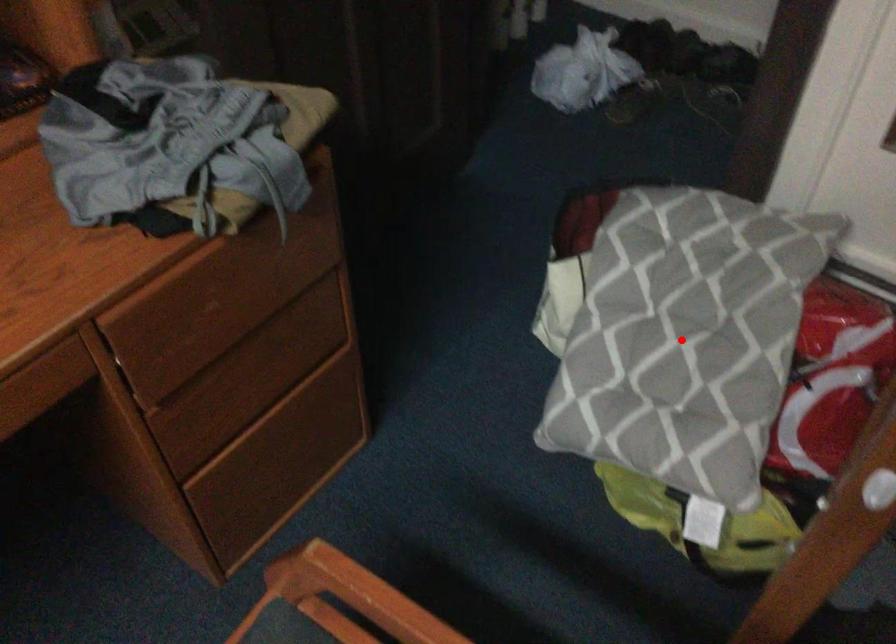
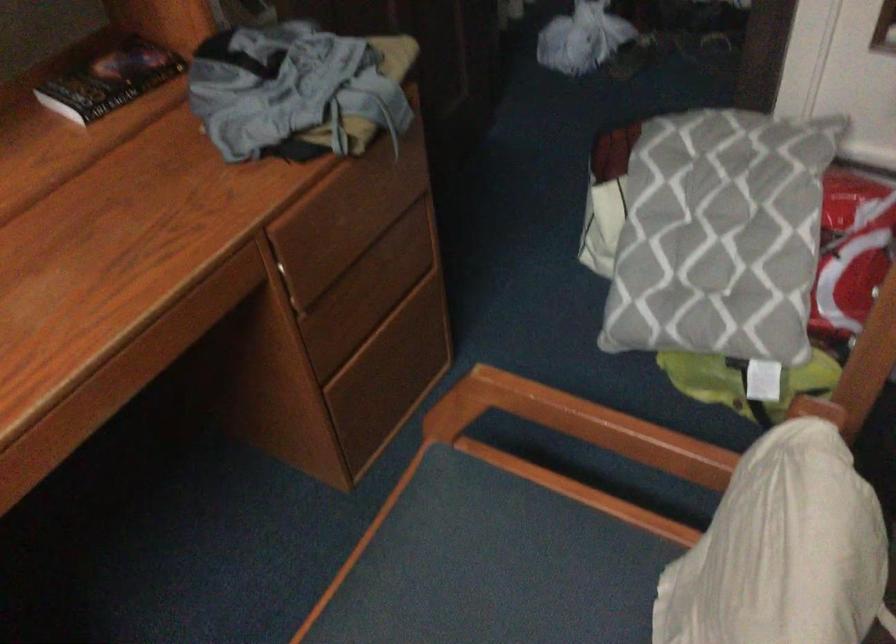
Question: I am providing you with two images of the same scene from different viewpoints. Image1 has a red point marked. In image2, the corresponding 3D location appears at what relative position? Reply with the corresponding letter.

Choices:
 (A) Closer
 (B) Farther

Answer: (B)